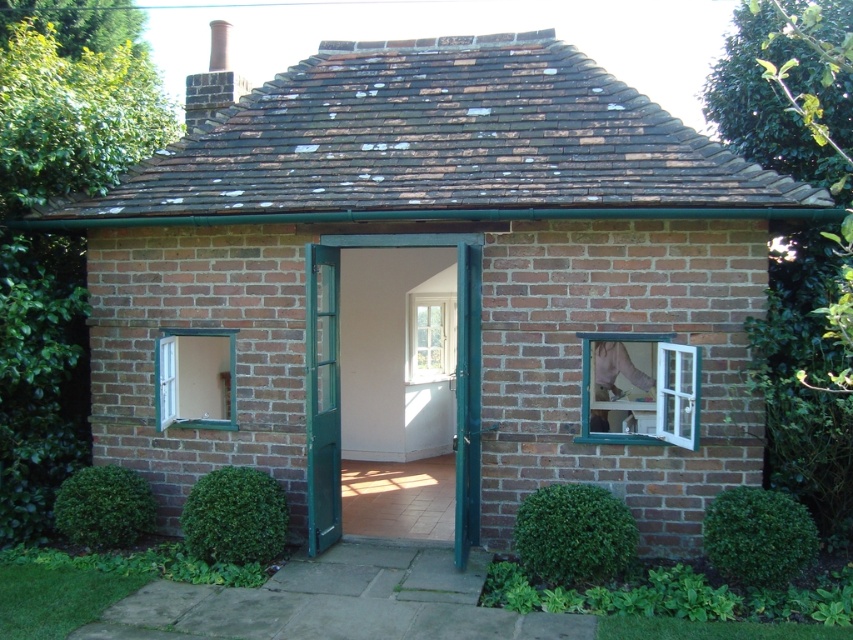
Question: Which object is the closest to the green leafy bush at lower right?

Choices:
 (A) green leafy hedge at lower center
 (B) green wooden door at center

Answer: (A)

Question: Estimate the real-world distances between objects in this image. Which object is farther from the green leafy bush at lower right?

Choices:
 (A) green wood window at lower left
 (B) green leafy bush at lower center
 (C) green wooden door at center
 (D) green leafy bush at lower left

Answer: (A)

Question: Does white wooden window at upper right appear under white wooden window at center?

Choices:
 (A) yes
 (B) no

Answer: (A)

Question: Does green wooden door at center appear on the right side of green leafy bush at lower left?

Choices:
 (A) yes
 (B) no

Answer: (A)

Question: Does green wooden door at center come behind green leafy bush at lower left?

Choices:
 (A) no
 (B) yes

Answer: (A)

Question: Which object is closer to the camera taking this photo?

Choices:
 (A) green leafy bush at lower right
 (B) green wooden door at center

Answer: (A)